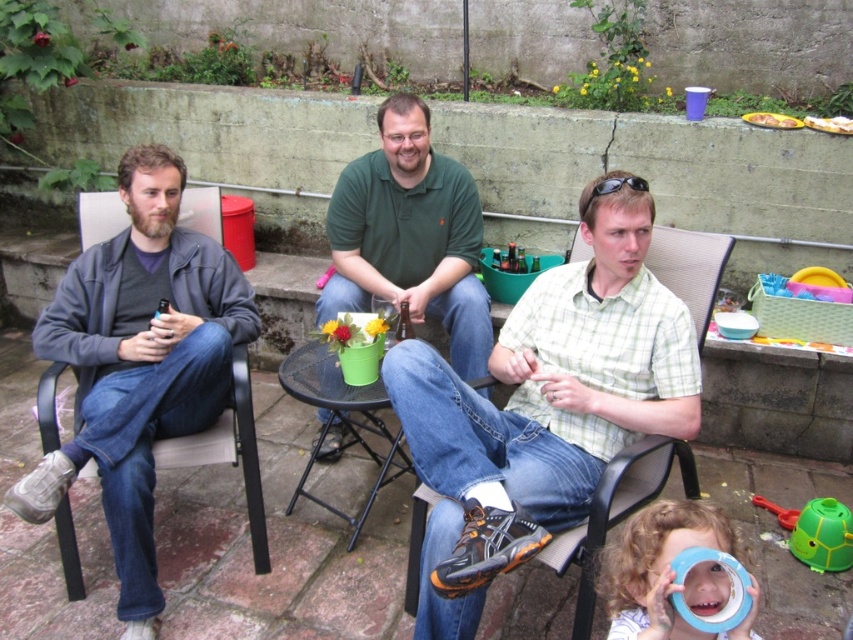
You are standing at the origin point in the image and want to locate the green matte shirt at center. Which direction should you move to find it?

The green matte shirt at center is located at coordinates 0.369 on the x axis and 0.481 on the y axis, so you should move to the right and forward from the origin point to reach it.

You are planning to set up a small table and chair for a quick snack. The matte plastic chair at center and the green plastic table at center are available. Which object should you choose if you want to ensure there is enough space for both items without overcrowding the area?

The matte plastic chair at center has a smaller size compared to the green plastic table at center, so choosing the smaller chair would allow more space around the table to prevent overcrowding.